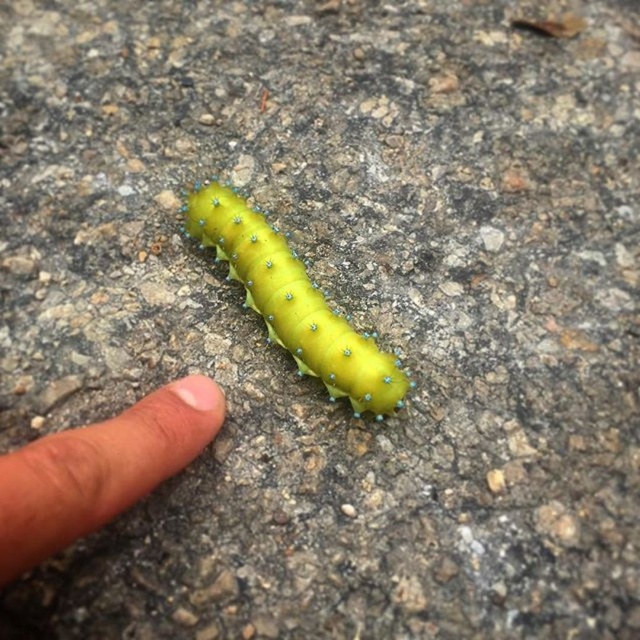
Question: Does flesh-toned skin at lower left have a greater width compared to green matte caterpillar at center?

Choices:
 (A) no
 (B) yes

Answer: (A)

Question: Does flesh-toned skin at lower left appear under green matte caterpillar at center?

Choices:
 (A) yes
 (B) no

Answer: (A)

Question: Which point appears closest to the camera in this image?

Choices:
 (A) (394, 392)
 (B) (26, 508)

Answer: (B)

Question: Which point is farther from the camera taking this photo?

Choices:
 (A) pyautogui.click(x=172, y=445)
 (B) pyautogui.click(x=380, y=397)

Answer: (B)

Question: Is flesh-toned skin at lower left bigger than green matte caterpillar at center?

Choices:
 (A) yes
 (B) no

Answer: (B)